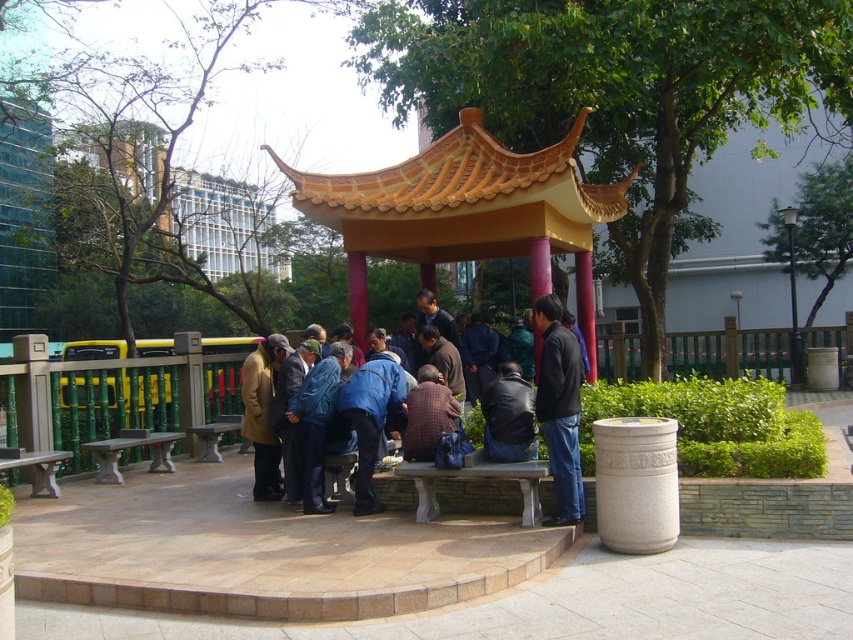
You are standing at the entrance of the park and see the matte orange gazebo at center. If you want to walk directly to it, which direction should you head?

Since the matte orange gazebo at center is located at point (465, 211), you should head towards the center of the park to reach it.

You are a photographer trying to capture a clear shot of the dark gray jacket at center without the blue fabric jacket at center blocking it. Based on the scene description, can you position yourself in a way to achieve this?

The dark gray jacket at center is in front of the blue fabric jacket at center, so you cannot position yourself to capture the dark gray jacket at center without the blue fabric jacket at center blocking it.